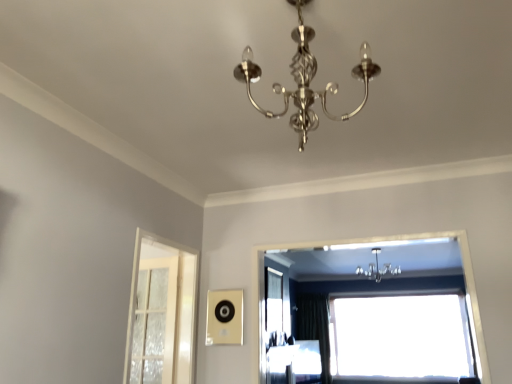
This screenshot has height=384, width=512. Identify the location of matte white curtain at lower center. (294, 363).

Describe the element at coordinates (315, 327) in the screenshot. I see `black velvet curtain at center` at that location.

What do you see at coordinates (378, 268) in the screenshot? I see `metallic chandelier at upper center` at bounding box center [378, 268].

Identify the location of white frosted glass screen door at left. (162, 312).

Is point (360, 75) positioned behind point (187, 324)?

That is False.

Where is `screen door below the shiny silver chandelier at center (from the image's perspective)`? The image size is (512, 384). screen door below the shiny silver chandelier at center (from the image's perspective) is located at coordinates (162, 312).

Would you say shiny silver chandelier at center is inside or outside white frosted glass screen door at left?

The correct answer is: outside.

Looking at this image, is shiny silver chandelier at center bigger or smaller than white frosted glass screen door at left?

Considering their sizes, shiny silver chandelier at center takes up less space than white frosted glass screen door at left.

Does white frosted glass screen door at left have a lesser height compared to metallic chandelier at upper center?

No, white frosted glass screen door at left is not shorter than metallic chandelier at upper center.

Is white frosted glass screen door at left wider than metallic chandelier at upper center?

In fact, white frosted glass screen door at left might be narrower than metallic chandelier at upper center.

From the picture: What's the angular difference between white frosted glass screen door at left and metallic chandelier at upper center's facing directions?

white frosted glass screen door at left and metallic chandelier at upper center are facing 91.1 degrees away from each other.

Is white frosted glass screen door at left facing away from metallic chandelier at upper center?

white frosted glass screen door at left does not have its back to metallic chandelier at upper center.

From the image's perspective, is matte white curtain at lower center under white frosted glass screen door at left?

Indeed, from the image's perspective, matte white curtain at lower center is shown beneath white frosted glass screen door at left.

Relative to white frosted glass screen door at left, is matte white curtain at lower center in front or behind?

matte white curtain at lower center is positioned farther from the viewer than white frosted glass screen door at left.

In the image, is matte white curtain at lower center on the left side or the right side of white frosted glass screen door at left?

matte white curtain at lower center is positioned on white frosted glass screen door at left's right side.

Could you tell me if matte white curtain at lower center is turned towards white frosted glass screen door at left?

No, matte white curtain at lower center does not turn towards white frosted glass screen door at left.

Considering the sizes of objects transparent glass window at upper center, arranged as the second window when viewed from the left, and white frosted glass screen door at left in the image provided, who is smaller, transparent glass window at upper center, arranged as the second window when viewed from the left, or white frosted glass screen door at left?

white frosted glass screen door at left.

Is white frosted glass screen door at left completely or partially inside transparent glass window at upper center, positioned as the 1th window in back-to-front order?

No, transparent glass window at upper center, positioned as the 1th window in back-to-front order, does not contain white frosted glass screen door at left.

Visually, is transparent glass window at upper center, which is counted as the second window, starting from the front, positioned to the left or to the right of white frosted glass screen door at left?

transparent glass window at upper center, which is counted as the second window, starting from the front, is positioned on white frosted glass screen door at left's right side.

Does white frosted glass screen door at left turn towards shiny silver chandelier at center?

No.

Which of these two, white frosted glass screen door at left or shiny silver chandelier at center, stands taller?

Standing taller between the two is white frosted glass screen door at left.

Would you consider white frosted glass screen door at left to be distant from shiny silver chandelier at center?

Yes.

Is white frosted glass screen door at left in front of or behind shiny silver chandelier at center in the image?

In the image, white frosted glass screen door at left appears behind shiny silver chandelier at center.

Based on the photo, is shiny silver chandelier at center positioned with its back to transparent glass window at center, which appears as the 1th window when viewed from the left?

shiny silver chandelier at center does not have its back to transparent glass window at center, which appears as the 1th window when viewed from the left.

From a real-world perspective, is shiny silver chandelier at center physically below transparent glass window at center, acting as the 2th window starting from the right?

No, from a real-world perspective, shiny silver chandelier at center is not below transparent glass window at center, acting as the 2th window starting from the right.

Does shiny silver chandelier at center have a smaller size compared to transparent glass window at center, positioned as the second window in back-to-front order?

Yes, shiny silver chandelier at center is smaller than transparent glass window at center, positioned as the second window in back-to-front order.

Which of these two, shiny silver chandelier at center or transparent glass window at center, acting as the 2th window starting from the right, stands shorter?

Standing shorter between the two is shiny silver chandelier at center.

Consider the image. Considering the sizes of matte white curtain at lower center and metallic chandelier at upper center in the image, is matte white curtain at lower center taller or shorter than metallic chandelier at upper center?

In the image, matte white curtain at lower center appears to be taller than metallic chandelier at upper center.

Is matte white curtain at lower center oriented towards metallic chandelier at upper center?

No, matte white curtain at lower center is not turned towards metallic chandelier at upper center.

Is matte white curtain at lower center in front of or behind metallic chandelier at upper center in the image?

In the image, matte white curtain at lower center appears behind metallic chandelier at upper center.

From a real-world perspective, is matte white curtain at lower center physically above metallic chandelier at upper center?

No, from a real-world perspective, matte white curtain at lower center is not over metallic chandelier at upper center

Image resolution: width=512 pixels, height=384 pixels. What are the coordinates of `screen door that appears on the left of shiny silver chandelier at center` in the screenshot? It's located at (162, 312).

Find the location of `screen door below the metallic chandelier at upper center (from a real-world perspective)`. screen door below the metallic chandelier at upper center (from a real-world perspective) is located at coordinates (162, 312).

Based on their spatial positions, is matte white curtain at lower center or metallic chandelier at upper center closer to shiny silver chandelier at center?

The object closer to shiny silver chandelier at center is metallic chandelier at upper center.

From the image, which object appears to be farther from metallic chandelier at upper center, black velvet curtain at center or transparent glass window at upper center, positioned as the 1th window in back-to-front order?

black velvet curtain at center is further to metallic chandelier at upper center.

Which object lies nearer to the anchor point metallic chandelier at upper center, transparent glass window at upper center, marked as the first window in a right-to-left arrangement, or black velvet curtain at center?

transparent glass window at upper center, marked as the first window in a right-to-left arrangement.

Estimate the real-world distances between objects in this image. Which object is closer to black velvet curtain at center, transparent glass window at center, placed as the 2th window when sorted from bottom to top, or white frosted glass screen door at left?

transparent glass window at center, placed as the 2th window when sorted from bottom to top, lies closer to black velvet curtain at center than the other object.

From the image, which object appears to be farther from metallic chandelier at upper center, shiny silver chandelier at center or transparent glass window at center, the 1th window from the front?

The object further to metallic chandelier at upper center is shiny silver chandelier at center.

Considering their positions, is matte white curtain at lower center positioned closer to transparent glass window at center, the 1th window in the top-to-bottom sequence, than metallic chandelier at upper center?

The object closer to transparent glass window at center, the 1th window in the top-to-bottom sequence, is matte white curtain at lower center.

Looking at the image, which one is located closer to transparent glass window at center, acting as the 2th window starting from the right, matte white curtain at lower center or shiny silver chandelier at center?

matte white curtain at lower center is positioned closer to the anchor transparent glass window at center, acting as the 2th window starting from the right.

Looking at the image, which one is located closer to white frosted glass screen door at left, shiny silver chandelier at center or matte white curtain at lower center?

shiny silver chandelier at center lies closer to white frosted glass screen door at left than the other object.

Locate an element on the screen. This screenshot has width=512, height=384. light fixture between transparent glass window at center, placed as the 2th window when sorted from bottom to top, and matte white curtain at lower center in the front-back direction is located at coordinates (378, 268).

The image size is (512, 384). Find the location of `furniture between transparent glass window at center, the 1th window from the front, and black velvet curtain at center from front to back`. furniture between transparent glass window at center, the 1th window from the front, and black velvet curtain at center from front to back is located at coordinates (294, 363).

Image resolution: width=512 pixels, height=384 pixels. In order to click on light fixture between transparent glass window at center, which appears as the 1th window when viewed from the left, and transparent glass window at upper center, arranged as the second window when viewed from the left, in the front-back direction in this screenshot , I will do `click(378, 268)`.

The height and width of the screenshot is (384, 512). I want to click on furniture located between white frosted glass screen door at left and transparent glass window at upper center, which is counted as the second window, starting from the front, in the depth direction, so click(x=294, y=363).